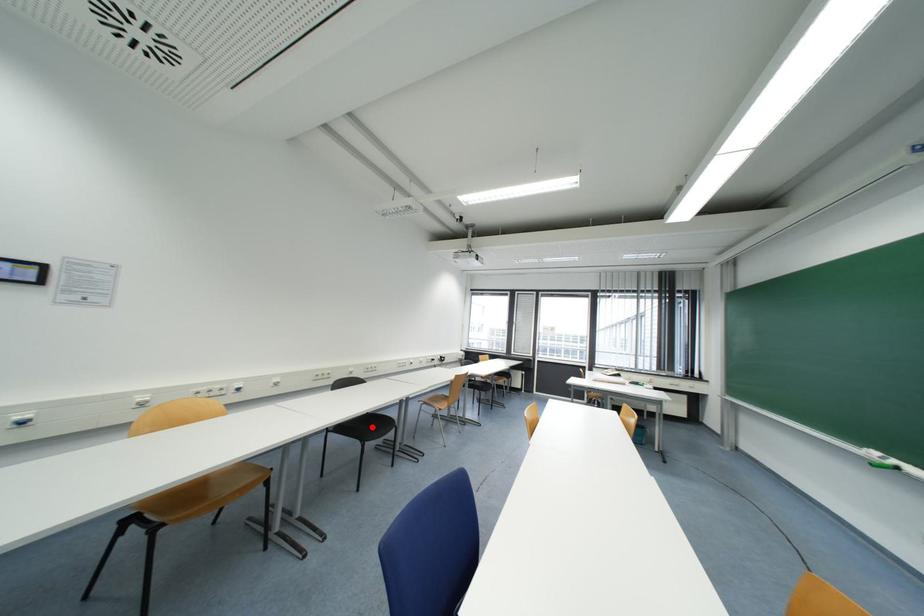
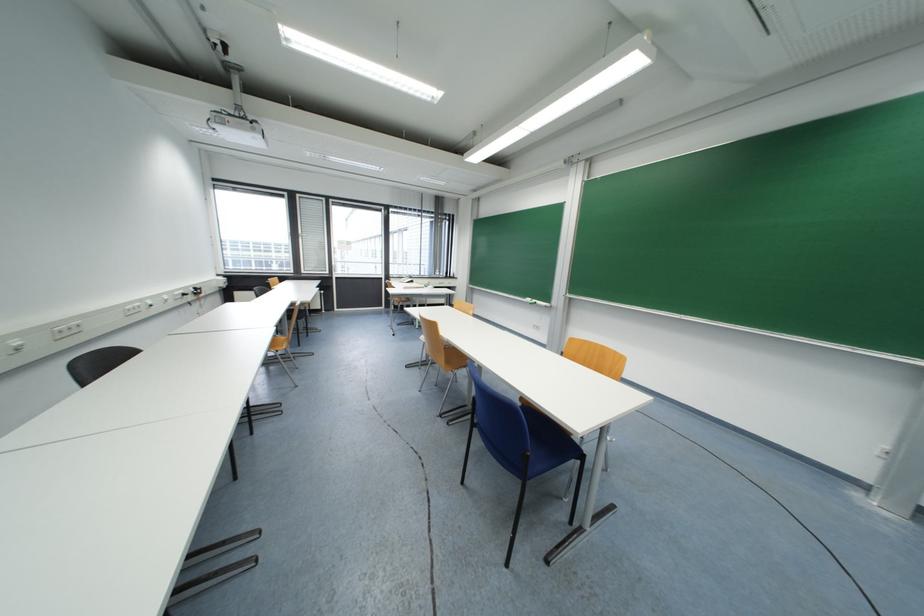
Question: I am providing you with two images of the same scene from different viewpoints. A red point is marked on the first image. At the location where the point appears in image 1, is it still visible in image 2?

Choices:
 (A) Yes
 (B) No

Answer: (B)